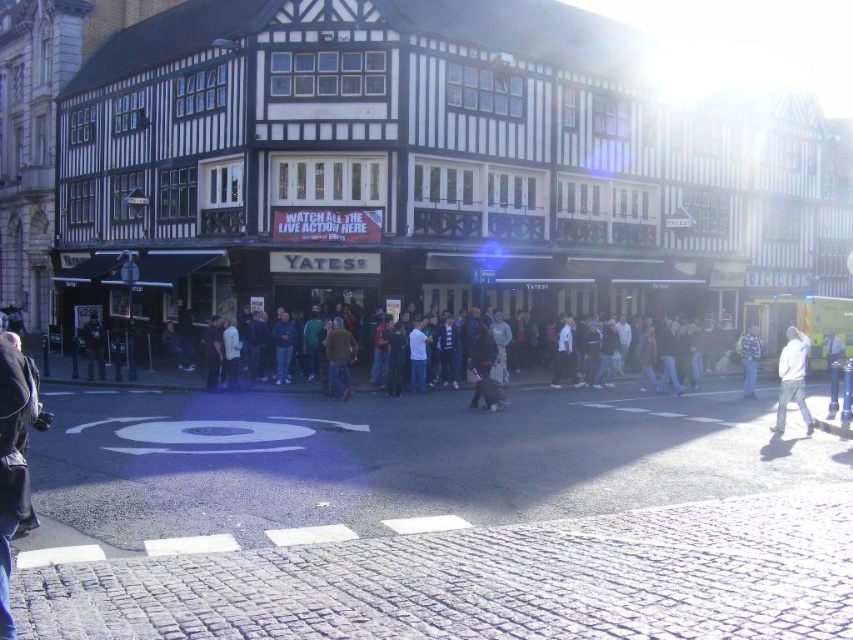
Can you confirm if dark blue jeans at lower left is positioned below striped jacket at center?

Actually, dark blue jeans at lower left is above striped jacket at center.

Is point (86, 362) closer to camera compared to point (747, 365)?

No, (86, 362) is behind (747, 365).

Where is `dark blue jeans at lower left`? This screenshot has width=853, height=640. dark blue jeans at lower left is located at coordinates (94, 346).

Who is taller, striped jacket at center or dark blue jeans at lower right?

With more height is striped jacket at center.

Does striped jacket at center appear over dark blue jeans at lower right?

Yes.

This screenshot has width=853, height=640. What are the coordinates of `striped jacket at center` in the screenshot? It's located at (749, 358).

Does white matte jacket at lower right have a smaller size compared to brown fabric jacket at center?

No, white matte jacket at lower right is not smaller than brown fabric jacket at center.

Is white matte jacket at lower right shorter than brown fabric jacket at center?

No.

Image resolution: width=853 pixels, height=640 pixels. I want to click on white matte jacket at lower right, so click(792, 380).